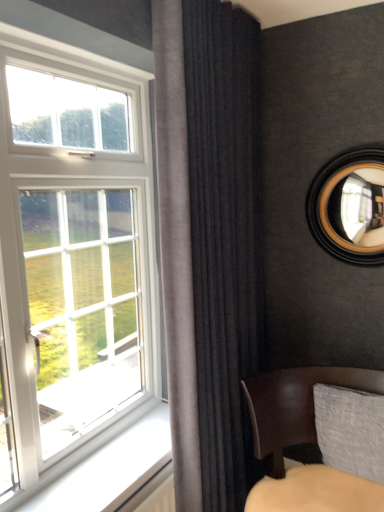
Question: From the image's perspective, is wooden-framed mirror at upper right positioned above or below leather cushion at lower right?

Choices:
 (A) below
 (B) above

Answer: (B)

Question: From a real-world perspective, is wooden-framed mirror at upper right physically located above or below leather cushion at lower right?

Choices:
 (A) above
 (B) below

Answer: (A)

Question: Considering the real-world distances, which object is farthest from the wooden-framed mirror at upper right?

Choices:
 (A) dark velvet curtain at center
 (B) leather cushion at lower right

Answer: (B)

Question: Considering the real-world distances, which object is farthest from the leather cushion at lower right?

Choices:
 (A) dark velvet curtain at center
 (B) wooden-framed mirror at upper right

Answer: (B)